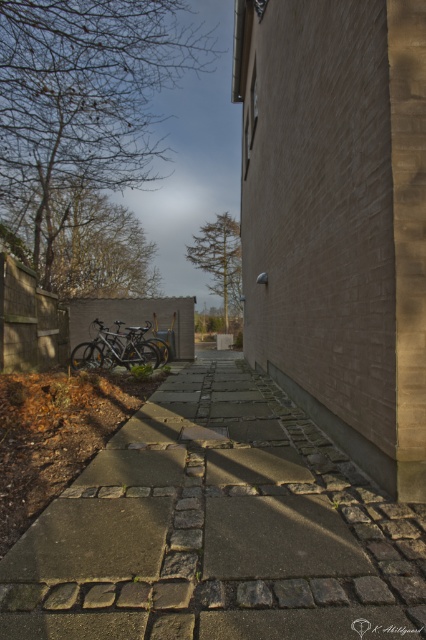
Looking at this image, you are a delivery person trying to navigate through the alley. You need to know if the shiny metallic bicycle at center is blocking the stone paved walkway at center. Is the bicycle positioned over the walkway?

The stone paved walkway at center is located below the shiny metallic bicycle at center, so the bicycle is positioned over the walkway, blocking it.

You are a delivery person trying to navigate through the alley. The alley is narrow, and you need to know if the shiny metallic bicycle at center is blocking the stone paved walkway at center. Can you determine if there is enough space to pass around the bicycle?

The stone paved walkway at center occupies less space than the shiny metallic bicycle at center, which means the bicycle is larger in size. Since the alley is narrow, the bicycle may be blocking most of the walkway, leaving limited space to pass around it. However, without knowing the exact dimensions of the walkway and bicycle, it is difficult to determine if there is enough space to navigate safely.